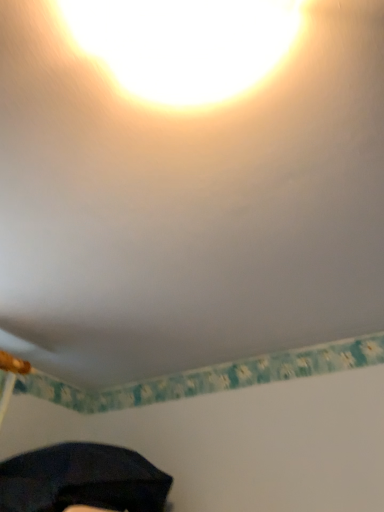
Question: From a real-world perspective, is dark matte umbrella at lower left physically located above or below matte yellow light at upper center?

Choices:
 (A) above
 (B) below

Answer: (B)

Question: Considering their positions, is dark matte umbrella at lower left located in front of or behind matte yellow light at upper center?

Choices:
 (A) front
 (B) behind

Answer: (B)

Question: Is dark matte umbrella at lower left spatially inside matte yellow light at upper center, or outside of it?

Choices:
 (A) inside
 (B) outside

Answer: (B)

Question: Is point (157, 15) positioned closer to the camera than point (117, 448)?

Choices:
 (A) closer
 (B) farther

Answer: (A)

Question: In terms of width, does matte yellow light at upper center look wider or thinner when compared to dark matte umbrella at lower left?

Choices:
 (A) thin
 (B) wide

Answer: (A)

Question: Would you say matte yellow light at upper center is inside or outside dark matte umbrella at lower left?

Choices:
 (A) inside
 (B) outside

Answer: (B)

Question: Looking at the image, does matte yellow light at upper center seem bigger or smaller compared to dark matte umbrella at lower left?

Choices:
 (A) big
 (B) small

Answer: (B)